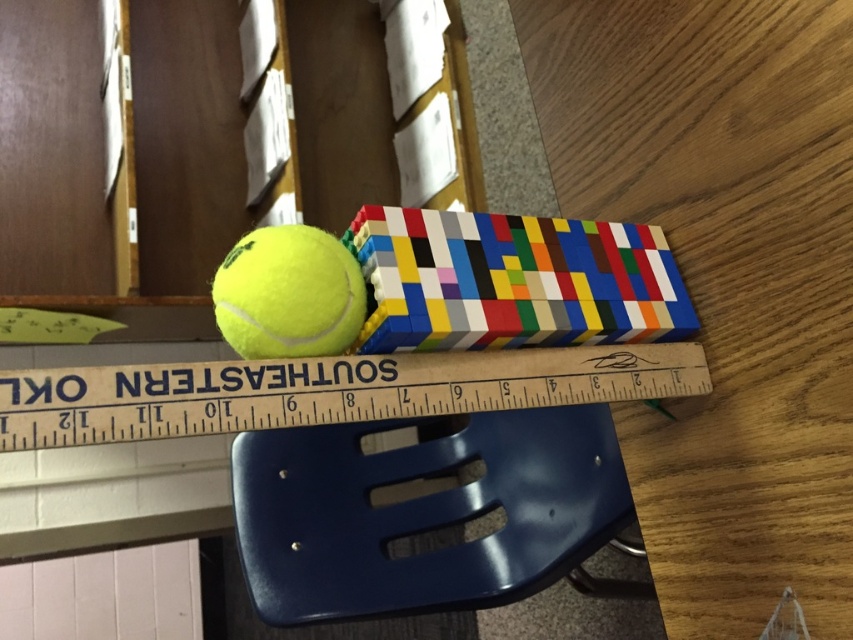
You are organizing items on a desk and need to place a book between the wooden ruler at center and the yellow matte tennis ball at center. Can you place the book directly between them without moving either object?

The wooden ruler at center is in front of the yellow matte tennis ball at center, so placing a book directly between them would require positioning it along the depth axis. However, since both objects are at the center, there might not be enough space between their positions to fit the book without moving them.

You are organizing a small event and need to place a blue plastic chair at lower center and a yellow matte tennis ball at center on a table. The table is 30 inches long. Will both items fit side by side on the table without overlapping?

The blue plastic chair at lower center is 26.87 inches away from the yellow matte tennis ball at center. Since the table is 30 inches long, the total distance between them is less than the table length, so they can fit side by side without overlapping.